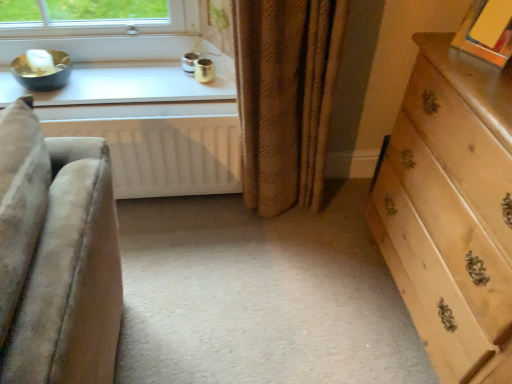
Where is `vacant space situated on the left part of brown textured curtain at center`? The width and height of the screenshot is (512, 384). vacant space situated on the left part of brown textured curtain at center is located at coordinates (173, 227).